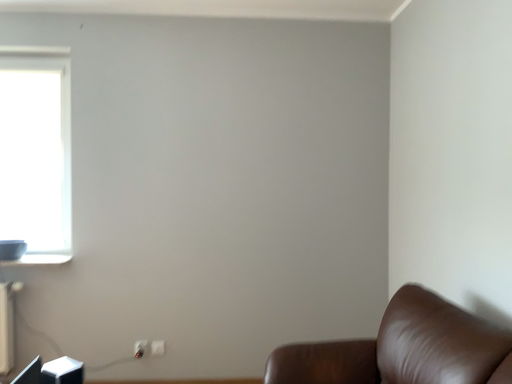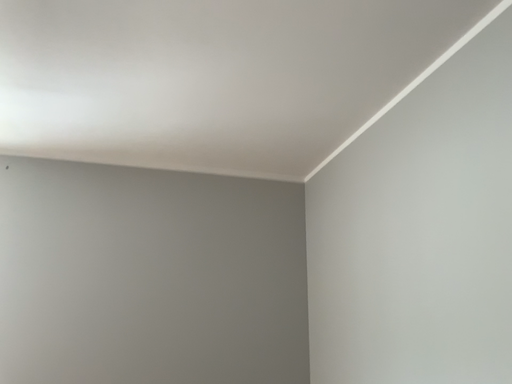
Question: Which way did the camera rotate in the video?

Choices:
 (A) rotated right
 (B) rotated left

Answer: (A)